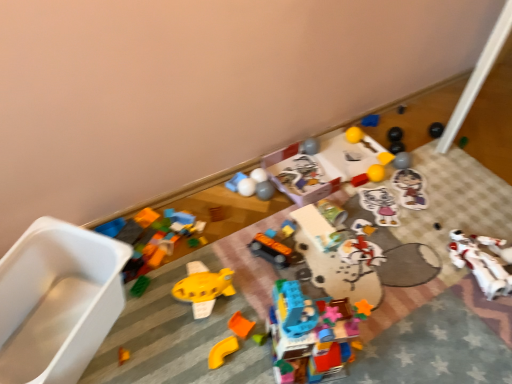
This screenshot has height=384, width=512. In order to click on vacant space that's between orange matte plastic toy at lower center, the fifteenth toy viewed from the right, and yellow matte toy boat at center, positioned as the second toy in left-to-right order in this screenshot , I will do `click(211, 336)`.